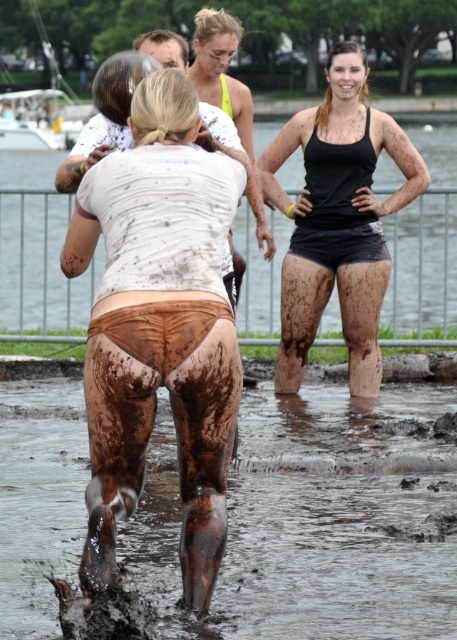
Is muddy water at lower center above matte black tank top at center?

Actually, muddy water at lower center is below matte black tank top at center.

Does muddy water at lower center appear on the right side of matte black tank top at center?

In fact, muddy water at lower center is to the left of matte black tank top at center.

Locate an element on the screen. The width and height of the screenshot is (457, 640). muddy water at lower center is located at coordinates (340, 516).

Where is `muddy water at lower center`? This screenshot has width=457, height=640. muddy water at lower center is located at coordinates (340, 516).

Is muddy fabric shorts at center shorter than matte black tank top at center?

Yes, muddy fabric shorts at center is shorter than matte black tank top at center.

What do you see at coordinates (159, 326) in the screenshot?
I see `muddy fabric shorts at center` at bounding box center [159, 326].

Locate an element on the screen. muddy fabric shorts at center is located at coordinates (159, 326).

Is point (143, 333) positioned behind point (288, 225)?

No, it is in front of (288, 225).

Measure the distance between muddy fabric shorts at center and camera.

They are 7.21 meters apart.

This screenshot has height=640, width=457. Identify the location of muddy fabric shorts at center. (159, 326).